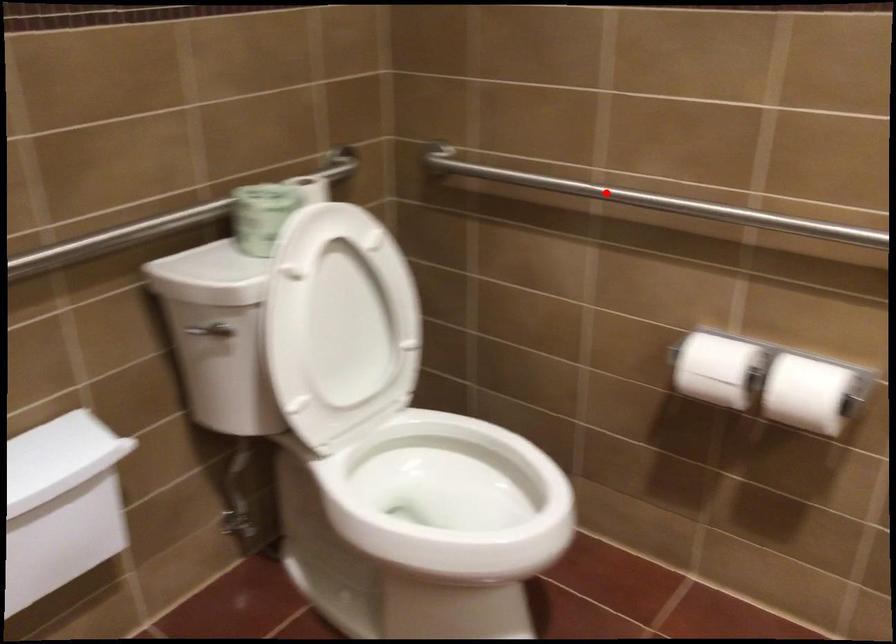
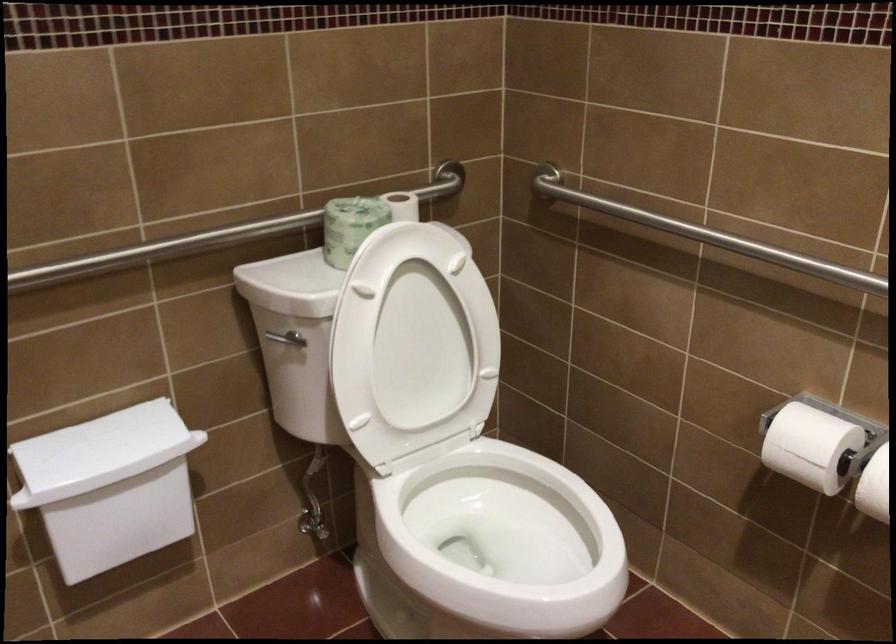
Find the pixel in the second image that matches the highlighted location in the first image.

(709, 236)